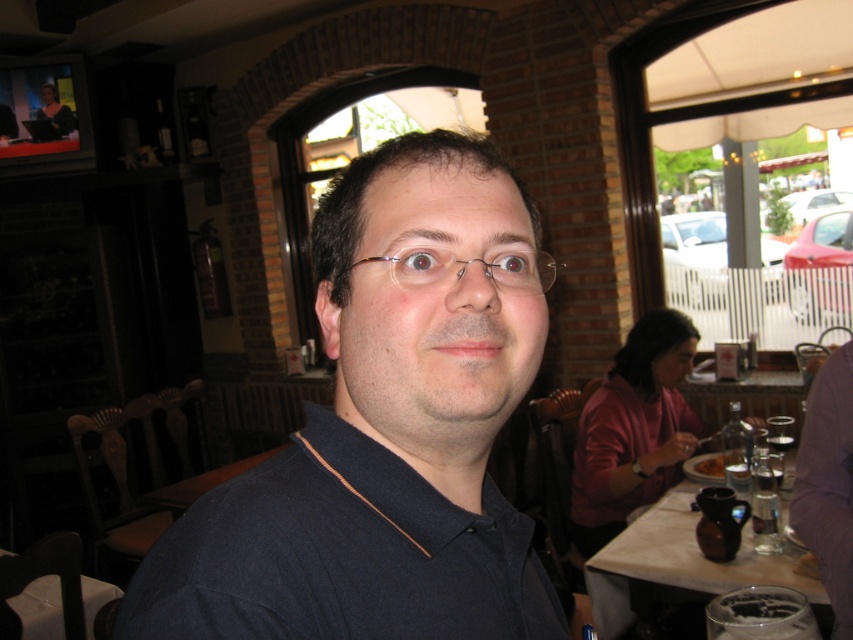
Question: Considering the real-world distances, which object is closest to the metallic wireframe glasses at center?

Choices:
 (A) transparent glass wine glass at right
 (B) dark blue cotton polo shirt at center

Answer: (B)

Question: Among these objects, which one is farthest from the camera?

Choices:
 (A) metallic wireframe glasses at center
 (B) transparent glass wine glass at right
 (C) dark blue cotton polo shirt at center
 (D) white ceramic table at lower right

Answer: (B)

Question: Is dark blue cotton polo shirt at center in front of transparent glass wine glass at right?

Choices:
 (A) yes
 (B) no

Answer: (A)

Question: Which of the following is the farthest from the observer?

Choices:
 (A) click(54, 620)
 (B) click(392, 202)

Answer: (A)

Question: Does dark blue fabric shirt at center appear on the right side of white glossy table at lower left?

Choices:
 (A) yes
 (B) no

Answer: (A)

Question: Is dark blue cotton polo shirt at center closer to the viewer compared to white ceramic table at lower right?

Choices:
 (A) yes
 (B) no

Answer: (A)